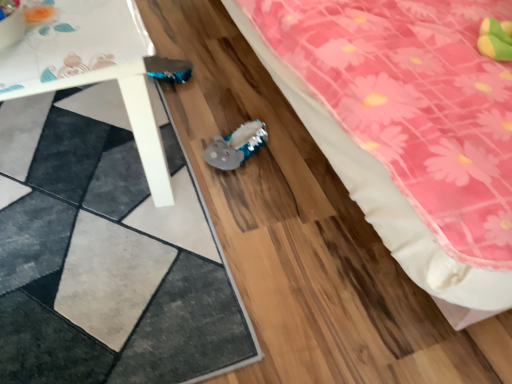
Find the location of a particular element. free spot below textured gray rug at lower left (from a real-world perspective) is located at coordinates (88, 218).